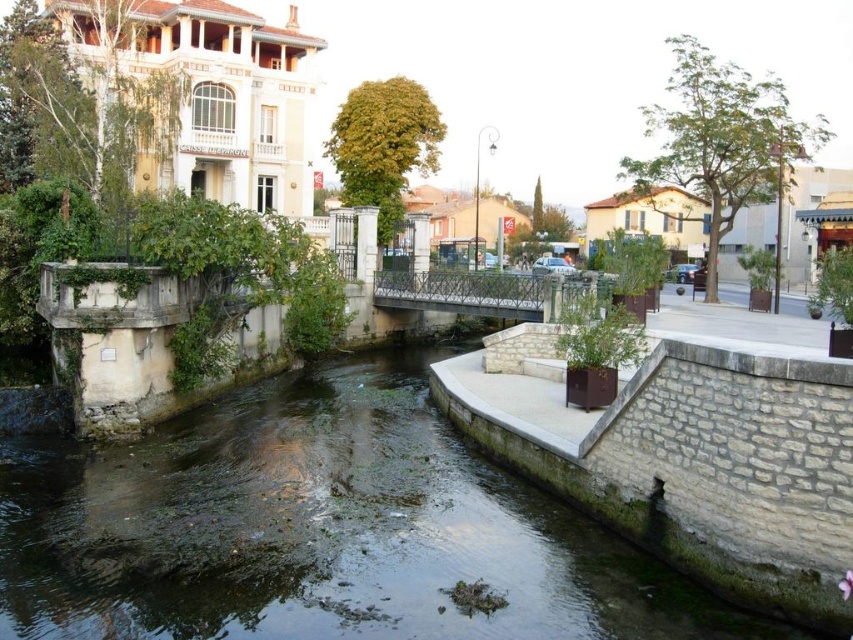
Between point (637, 570) and point (548, 317), which one is positioned behind?

The point (548, 317) is behind.

Is green mossy stone river at center taller than metallic bridge at center?

No.

Who is more distant from viewer, (x=647, y=556) or (x=434, y=301)?

Positioned behind is point (x=434, y=301).

This screenshot has height=640, width=853. What are the coordinates of `green mossy stone river at center` in the screenshot? It's located at (318, 529).